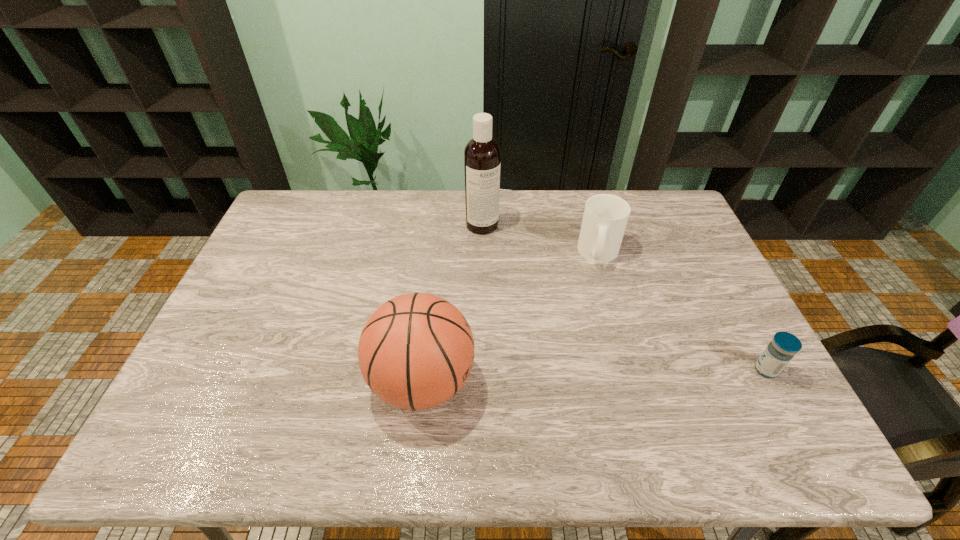
Identify the location of free space at the far edge of the desktop. Image resolution: width=960 pixels, height=540 pixels. (454, 199).

The height and width of the screenshot is (540, 960). I want to click on vacant space at the near edge of the desktop, so click(441, 405).

At what (x,y) coordinates should I click in order to perform the action: click on vacant space at the left edge. Please return your answer as a coordinate pair (x, y). Looking at the image, I should click on (298, 271).

In the image, there is a desktop. At what (x,y) coordinates should I click in order to perform the action: click on vacant area at the right edge. Please return your answer as a coordinate pair (x, y). The image size is (960, 540). Looking at the image, I should click on (718, 308).

This screenshot has height=540, width=960. What are the coordinates of `empty space that is in between the third object from left to right and the farthest object` in the screenshot? It's located at (540, 239).

The image size is (960, 540). In order to click on unoccupied area between the mug and the medicine in this screenshot , I will do `click(683, 312)`.

At what (x,y) coordinates should I click in order to perform the action: click on vacant space in between the basketball and the farthest object. Please return your answer as a coordinate pair (x, y). This screenshot has height=540, width=960. Looking at the image, I should click on (452, 303).

Locate an element on the screen. This screenshot has width=960, height=540. free area in between the third shortest object and the medicine is located at coordinates (594, 376).

Image resolution: width=960 pixels, height=540 pixels. I want to click on vacant space that's between the tallest object and the second tallest object, so click(452, 303).

At what (x,y) coordinates should I click in order to perform the action: click on empty space that is in between the second object from right to left and the shortest object. Please return your answer as a coordinate pair (x, y). This screenshot has width=960, height=540. Looking at the image, I should click on (683, 312).